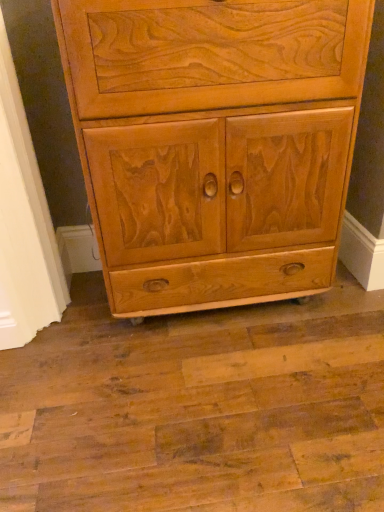
What do you see at coordinates (214, 143) in the screenshot? Image resolution: width=384 pixels, height=512 pixels. I see `matte wood cabinet at center` at bounding box center [214, 143].

Where is `matte wood cabinet at center`? matte wood cabinet at center is located at coordinates (214, 143).

What is the approximate width of matte wood cabinet at lower left?

matte wood cabinet at lower left is 3.73 centimeters wide.

I want to click on matte wood cabinet at lower left, so click(x=24, y=223).

Image resolution: width=384 pixels, height=512 pixels. Describe the element at coordinates (24, 223) in the screenshot. I see `matte wood cabinet at lower left` at that location.

This screenshot has height=512, width=384. What are the coordinates of `matte wood cabinet at center` in the screenshot? It's located at (214, 143).

In the image, is matte wood cabinet at lower left on the left side or the right side of matte wood cabinet at center?

In the image, matte wood cabinet at lower left appears on the left side of matte wood cabinet at center.

Which object is more forward, matte wood cabinet at lower left or matte wood cabinet at center?

matte wood cabinet at center.

Is point (11, 177) positioned before point (102, 237)?

Yes, point (11, 177) is in front of point (102, 237).

From the image's perspective, which object appears higher, matte wood cabinet at lower left or matte wood cabinet at center?

matte wood cabinet at center is shown above in the image.

From a real-world perspective, is matte wood cabinet at lower left physically located above or below matte wood cabinet at center?

matte wood cabinet at lower left is situated higher than matte wood cabinet at center in the real world.

In the scene shown: Which object is thinner, matte wood cabinet at lower left or matte wood cabinet at center?

matte wood cabinet at lower left.

Can you confirm if matte wood cabinet at lower left is taller than matte wood cabinet at center?

Yes.

Which of these two, matte wood cabinet at lower left or matte wood cabinet at center, is smaller?

matte wood cabinet at lower left is smaller.

Is matte wood cabinet at lower left completely or partially outside of matte wood cabinet at center?

matte wood cabinet at lower left is positioned outside matte wood cabinet at center.

Would you consider matte wood cabinet at lower left to be distant from matte wood cabinet at center?

No.

Is matte wood cabinet at lower left looking in the opposite direction of matte wood cabinet at center?

That's not correct — matte wood cabinet at lower left is not looking away from matte wood cabinet at center.

Identify the location of screen door below the matte wood cabinet at center (from the image's perspective). (24, 223).

Visually, is matte wood cabinet at center positioned to the left or to the right of matte wood cabinet at lower left?

Clearly, matte wood cabinet at center is on the right of matte wood cabinet at lower left in the image.

Does matte wood cabinet at center come behind matte wood cabinet at lower left?

No, matte wood cabinet at center is closer to the camera.

Is point (276, 95) farther from viewer compared to point (29, 227)?

That is False.

From the image's perspective, between matte wood cabinet at center and matte wood cabinet at lower left, who is located below?

matte wood cabinet at lower left is shown below in the image.

From a real-world perspective, which is physically above, matte wood cabinet at center or matte wood cabinet at lower left?

In real-world perspective, matte wood cabinet at lower left is above.

In the scene shown: Can you confirm if matte wood cabinet at center is wider than matte wood cabinet at lower left?

Yes, matte wood cabinet at center is wider than matte wood cabinet at lower left.

Is matte wood cabinet at center taller than matte wood cabinet at lower left?

No.

Which of these two, matte wood cabinet at center or matte wood cabinet at lower left, is bigger?

matte wood cabinet at center.

Is matte wood cabinet at center located outside matte wood cabinet at lower left?

Yes, matte wood cabinet at center is outside of matte wood cabinet at lower left.

Are matte wood cabinet at center and matte wood cabinet at lower left beside each other?

No, matte wood cabinet at center is not touching matte wood cabinet at lower left.

Is matte wood cabinet at center looking in the opposite direction of matte wood cabinet at lower left?

No, matte wood cabinet at center is not facing away from matte wood cabinet at lower left.

How many degrees apart are the facing directions of matte wood cabinet at center and matte wood cabinet at lower left?

They differ by 89.6 degrees in their facing directions.

At what (x,y) coordinates should I click in order to perform the action: click on the chest of drawers above the matte wood cabinet at lower left (from the image's perspective). Please return your answer as a coordinate pair (x, y). The width and height of the screenshot is (384, 512). Looking at the image, I should click on (214, 143).

At what (x,y) coordinates should I click in order to perform the action: click on screen door on the left of matte wood cabinet at center. Please return your answer as a coordinate pair (x, y). Looking at the image, I should click on (24, 223).

At what (x,y) coordinates should I click in order to perform the action: click on screen door that appears above the matte wood cabinet at center (from a real-world perspective). Please return your answer as a coordinate pair (x, y). The width and height of the screenshot is (384, 512). Looking at the image, I should click on pos(24,223).